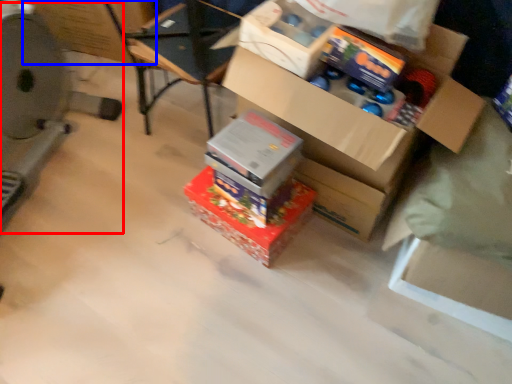
Question: Among these objects, which one is farthest to the camera, wide (highlighted by a red box) or cardboard box (highlighted by a blue box)?

Choices:
 (A) wide
 (B) cardboard box

Answer: (B)